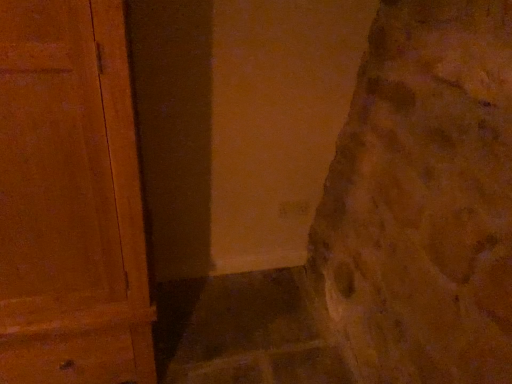
Identify the location of matte wood door at left. (70, 199).

This screenshot has height=384, width=512. What do you see at coordinates (70, 199) in the screenshot?
I see `matte wood door at left` at bounding box center [70, 199].

This screenshot has width=512, height=384. Find the location of `matte wood door at left`. matte wood door at left is located at coordinates (70, 199).